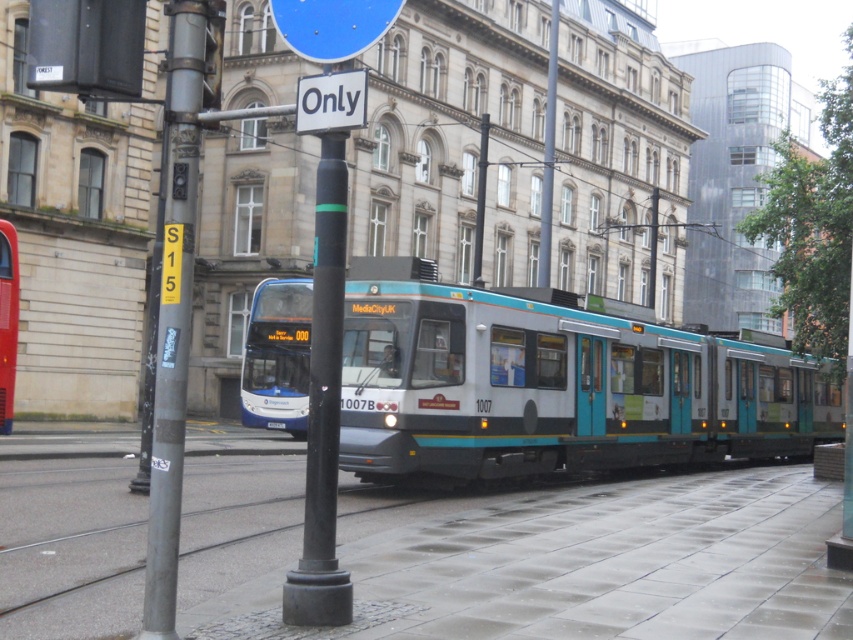
Can you confirm if blue metallic bus at center is positioned above matte blue bus at center?

Incorrect, blue metallic bus at center is not positioned above matte blue bus at center.

Between point (265, 321) and point (0, 426), which one is positioned in front?

Positioned in front is point (0, 426).

Where is `blue metallic bus at center`? This screenshot has height=640, width=853. blue metallic bus at center is located at coordinates (277, 356).

Is gray concrete pavement at center further to camera compared to blue glossy sign at upper center?

Yes.

The image size is (853, 640). Find the location of `gray concrete pavement at center`. gray concrete pavement at center is located at coordinates (590, 566).

Is point (534, 522) in front of point (318, 29)?

No, it is not.

Locate an element on the screen. Image resolution: width=853 pixels, height=640 pixels. gray concrete pavement at center is located at coordinates (590, 566).

Based on the photo, is teal glossy tram at center above white plastic sign at upper center?

Incorrect, teal glossy tram at center is not positioned above white plastic sign at upper center.

Where is `teal glossy tram at center`? teal glossy tram at center is located at coordinates (554, 385).

Where is `teal glossy tram at center`? The width and height of the screenshot is (853, 640). teal glossy tram at center is located at coordinates click(x=554, y=385).